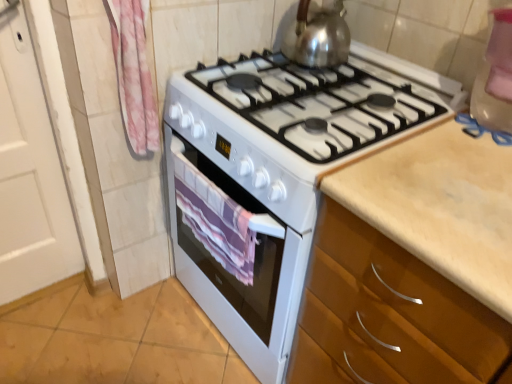
Question: Should I look upward or downward to see shiny metallic kettle at upper center?

Choices:
 (A) down
 (B) up

Answer: (B)

Question: Does shiny metallic kettle at upper center have a greater height compared to white glossy stove at center?

Choices:
 (A) no
 (B) yes

Answer: (A)

Question: From the image's perspective, would you say shiny metallic kettle at upper center is positioned over white glossy stove at center?

Choices:
 (A) no
 (B) yes

Answer: (B)

Question: Is shiny metallic kettle at upper center to the left of white glossy stove at center from the viewer's perspective?

Choices:
 (A) yes
 (B) no

Answer: (B)

Question: Can you confirm if shiny metallic kettle at upper center is thinner than white glossy stove at center?

Choices:
 (A) no
 (B) yes

Answer: (B)

Question: From a real-world perspective, is shiny metallic kettle at upper center beneath white glossy stove at center?

Choices:
 (A) yes
 (B) no

Answer: (B)

Question: Considering the relative sizes of shiny metallic kettle at upper center and white glossy stove at center in the image provided, is shiny metallic kettle at upper center smaller than white glossy stove at center?

Choices:
 (A) yes
 (B) no

Answer: (A)

Question: Does pink fabric towel at left have a lesser width compared to purple striped towel at center?

Choices:
 (A) yes
 (B) no

Answer: (B)

Question: From the image's perspective, would you say pink fabric towel at left is positioned over purple striped towel at center?

Choices:
 (A) no
 (B) yes

Answer: (B)

Question: Is purple striped towel at center a part of pink fabric towel at left?

Choices:
 (A) no
 (B) yes

Answer: (A)

Question: Can we say pink fabric towel at left lies outside purple striped towel at center?

Choices:
 (A) yes
 (B) no

Answer: (A)

Question: From a real-world perspective, is pink fabric towel at left over purple striped towel at center?

Choices:
 (A) no
 (B) yes

Answer: (B)

Question: Does pink fabric towel at left have a greater height compared to purple striped towel at center?

Choices:
 (A) no
 (B) yes

Answer: (B)

Question: Is white glossy stove at center at the back of pink fabric towel at left?

Choices:
 (A) yes
 (B) no

Answer: (B)